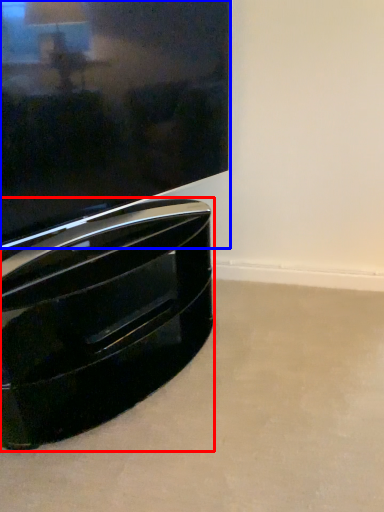
Question: Which object appears farthest to the camera in this image, furniture (highlighted by a red box) or television (highlighted by a blue box)?

Choices:
 (A) furniture
 (B) television

Answer: (A)